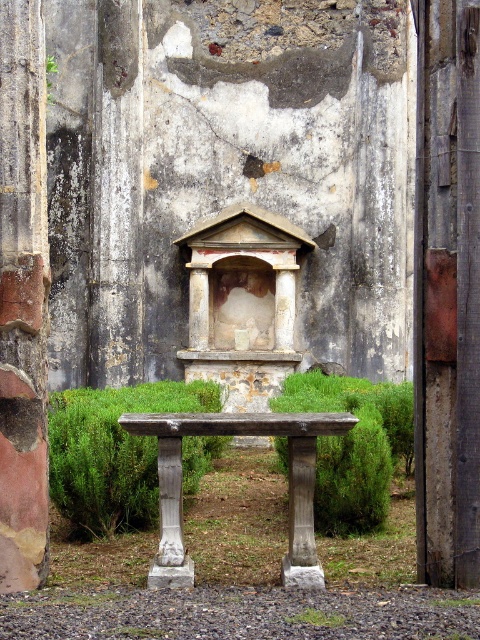
Between rustic stone column at left and wooden table at center, which one has less height?

rustic stone column at left

This screenshot has width=480, height=640. In order to click on rustic stone column at left in this screenshot , I will do `click(23, 298)`.

Is point (7, 580) positioned after point (156, 586)?

That is False.

This screenshot has width=480, height=640. I want to click on rustic stone column at left, so click(23, 298).